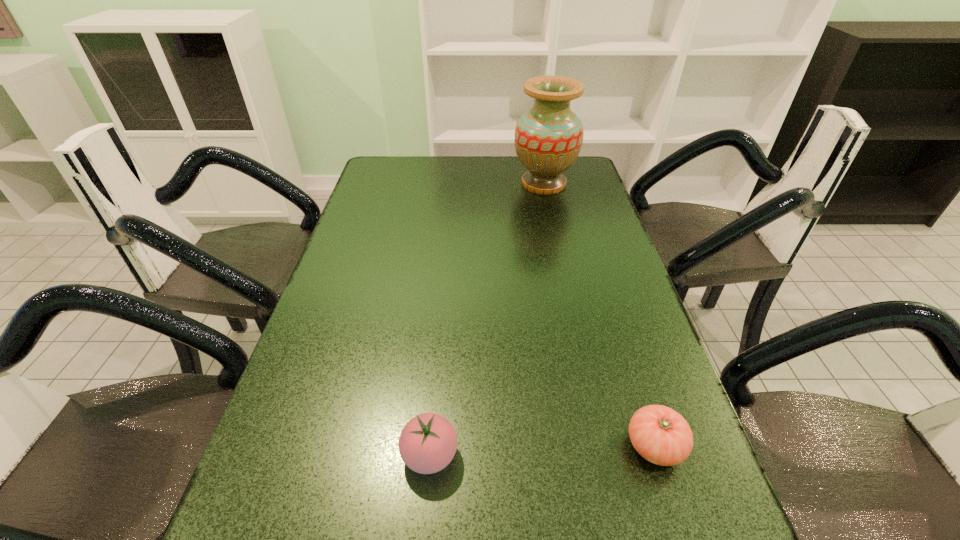
The width and height of the screenshot is (960, 540). I want to click on the farthest object, so click(548, 138).

You are a GUI agent. You are given a task and a screenshot of the screen. Output one action in this format:
    pyautogui.click(x=<x>, y=<y>)
    Task: Click on the tallest object
    Image resolution: width=960 pixels, height=540 pixels.
    Given the screenshot: What is the action you would take?
    pyautogui.click(x=548, y=138)

Where is `the left tomato`? the left tomato is located at coordinates (428, 442).

In order to click on the shorter tomato in this screenshot , I will do `click(662, 436)`.

You are a GUI agent. You are given a task and a screenshot of the screen. Output one action in this format:
    pyautogui.click(x=<x>, y=<y>)
    Task: Click on the right tomato
    
    Given the screenshot: What is the action you would take?
    pyautogui.click(x=662, y=436)

Where is `blank space located on the left of the tallest object`? blank space located on the left of the tallest object is located at coordinates (468, 184).

Image resolution: width=960 pixels, height=540 pixels. I want to click on vacant area located on the left of the leftmost object, so click(329, 455).

Image resolution: width=960 pixels, height=540 pixels. I want to click on free spot located 0.080m on the front of the shorter tomato, so click(x=680, y=524).

The image size is (960, 540). In order to click on object that is positioned at the far edge in this screenshot , I will do `click(548, 138)`.

Identify the location of vase present at the right edge. The width and height of the screenshot is (960, 540). (548, 138).